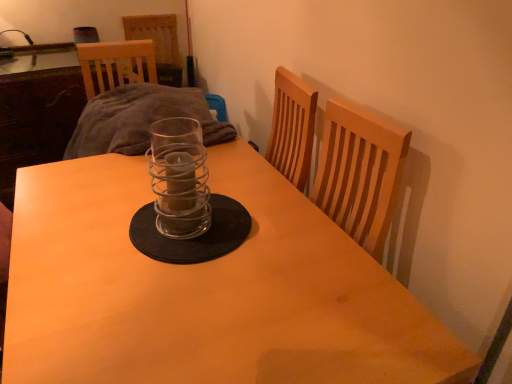
Question: Considering the positions of point (150, 162) and point (348, 302), is point (150, 162) closer or farther from the camera than point (348, 302)?

Choices:
 (A) closer
 (B) farther

Answer: (B)

Question: From a real-world perspective, is clear glass candle holder at center above or below wooden table at center?

Choices:
 (A) above
 (B) below

Answer: (A)

Question: Would you say clear glass candle holder at center is to the left or to the right of wooden table at center in the picture?

Choices:
 (A) left
 (B) right

Answer: (B)

Question: In terms of width, does wooden table at center look wider or thinner when compared to clear glass candle holder at center?

Choices:
 (A) thin
 (B) wide

Answer: (B)

Question: Is wooden table at center spatially inside clear glass candle holder at center, or outside of it?

Choices:
 (A) outside
 (B) inside

Answer: (A)

Question: Is point (373, 273) closer or farther from the camera than point (201, 178)?

Choices:
 (A) farther
 (B) closer

Answer: (B)

Question: From the image's perspective, is wooden table at center located above or below clear glass candle holder at center?

Choices:
 (A) above
 (B) below

Answer: (B)